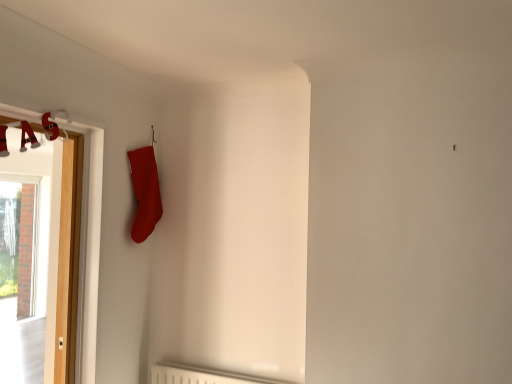
What do you see at coordinates (19, 241) in the screenshot? This screenshot has height=384, width=512. I see `clear glass window screen at left` at bounding box center [19, 241].

This screenshot has width=512, height=384. What are the coordinates of `clear glass window screen at left` in the screenshot? It's located at (19, 241).

Locate an element on the screen. The image size is (512, 384). clear glass window screen at left is located at coordinates (19, 241).